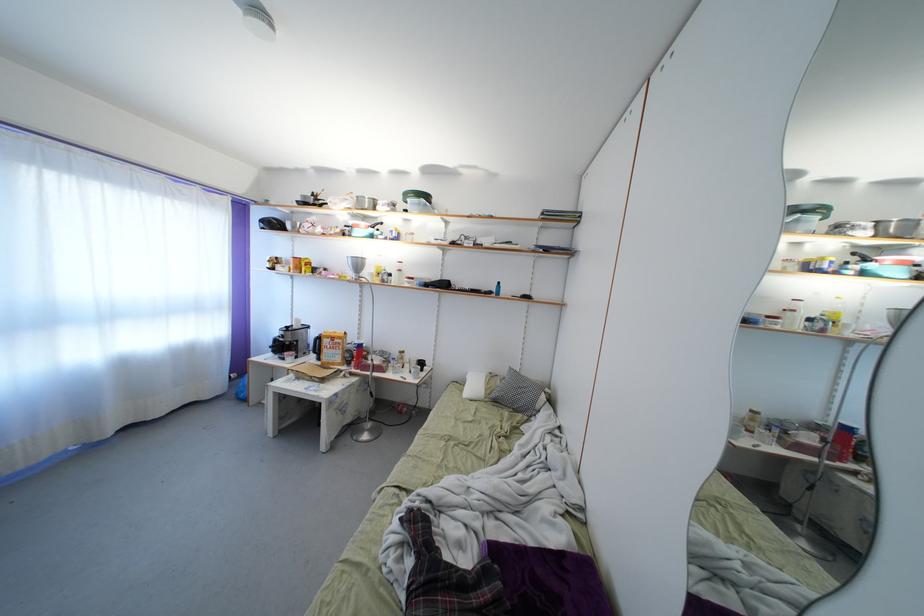
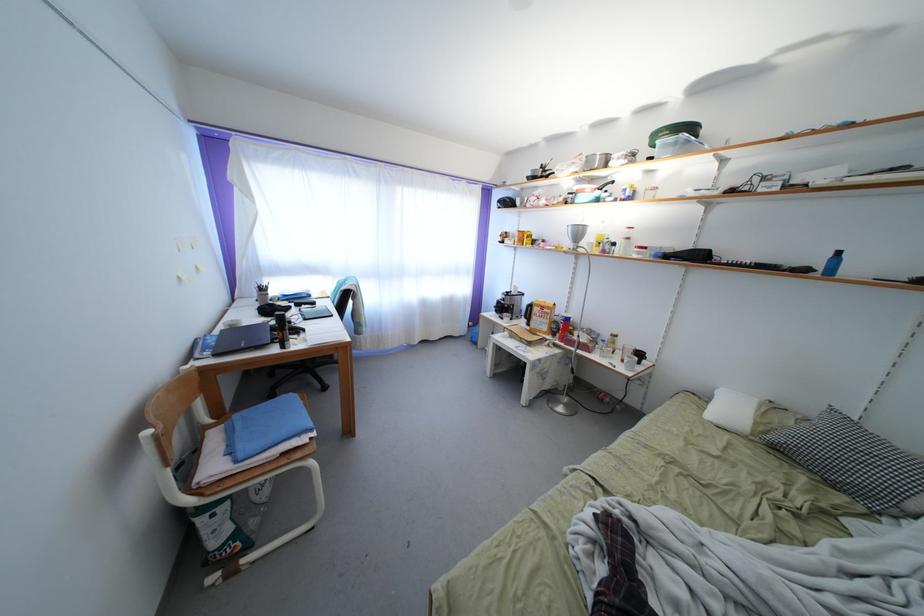
Find the pixel in the second image that matches (x=280, y=358) in the first image.

(503, 317)